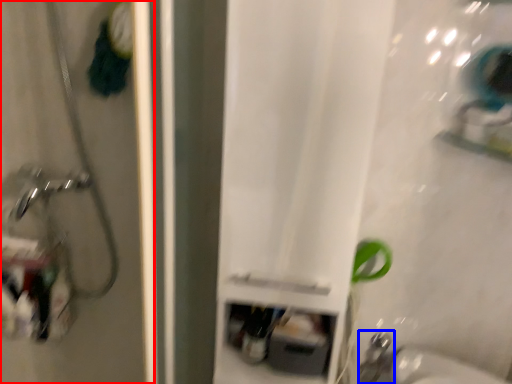
Question: Which point is closer to the camera, screen door (highlighted by a red box) or faucet (highlighted by a blue box)?

Choices:
 (A) screen door
 (B) faucet

Answer: (A)